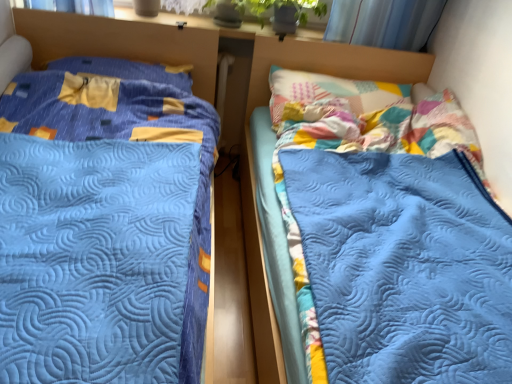
Question: From the image's perspective, is yellow fabric pillow at upper left on blue quilted bed at left, placed as the 2th bed when sorted from right to left?

Choices:
 (A) no
 (B) yes

Answer: (B)

Question: Is yellow fabric pillow at upper left oriented away from blue quilted bed at left, placed as the 2th bed when sorted from right to left?

Choices:
 (A) no
 (B) yes

Answer: (B)

Question: Considering the relative positions of yellow fabric pillow at upper left and blue quilted bed at left, placed as the first bed when sorted from left to right, in the image provided, is yellow fabric pillow at upper left in front of blue quilted bed at left, placed as the first bed when sorted from left to right,?

Choices:
 (A) no
 (B) yes

Answer: (A)

Question: Does yellow fabric pillow at upper left have a greater height compared to blue quilted bed at left, placed as the 2th bed when sorted from right to left?

Choices:
 (A) no
 (B) yes

Answer: (A)

Question: Is yellow fabric pillow at upper left to the right of blue quilted bed at left, placed as the 2th bed when sorted from right to left, from the viewer's perspective?

Choices:
 (A) yes
 (B) no

Answer: (B)

Question: From the image's perspective, is yellow fabric pillow at upper left above or below blue quilted bed at center, the 2th bed from the left?

Choices:
 (A) below
 (B) above

Answer: (B)

Question: In terms of size, does yellow fabric pillow at upper left appear bigger or smaller than blue quilted bed at center, placed as the first bed when sorted from right to left?

Choices:
 (A) small
 (B) big

Answer: (A)

Question: From a real-world perspective, is yellow fabric pillow at upper left positioned above or below blue quilted bed at center, the 2th bed from the left?

Choices:
 (A) above
 (B) below

Answer: (A)

Question: Relative to blue quilted bed at center, placed as the first bed when sorted from right to left, is yellow fabric pillow at upper left in front or behind?

Choices:
 (A) behind
 (B) front

Answer: (A)

Question: Considering the positions of blue quilted bed at left, placed as the first bed when sorted from left to right, and yellow fabric pillow at upper left in the image, is blue quilted bed at left, placed as the first bed when sorted from left to right, wider or thinner than yellow fabric pillow at upper left?

Choices:
 (A) thin
 (B) wide

Answer: (B)

Question: Considering their positions, is blue quilted bed at left, placed as the first bed when sorted from left to right, located in front of or behind yellow fabric pillow at upper left?

Choices:
 (A) front
 (B) behind

Answer: (A)

Question: From the image's perspective, relative to yellow fabric pillow at upper left, is blue quilted bed at left, placed as the first bed when sorted from left to right, above or below?

Choices:
 (A) below
 (B) above

Answer: (A)

Question: Is blue quilted bed at left, placed as the first bed when sorted from left to right, bigger or smaller than yellow fabric pillow at upper left?

Choices:
 (A) big
 (B) small

Answer: (A)

Question: From a real-world perspective, relative to blue quilted bed at left, placed as the first bed when sorted from left to right, is yellow fabric pillow at upper left vertically above or below?

Choices:
 (A) above
 (B) below

Answer: (A)

Question: In terms of height, does yellow fabric pillow at upper left look taller or shorter compared to blue quilted bed at left, placed as the first bed when sorted from left to right?

Choices:
 (A) short
 (B) tall

Answer: (A)